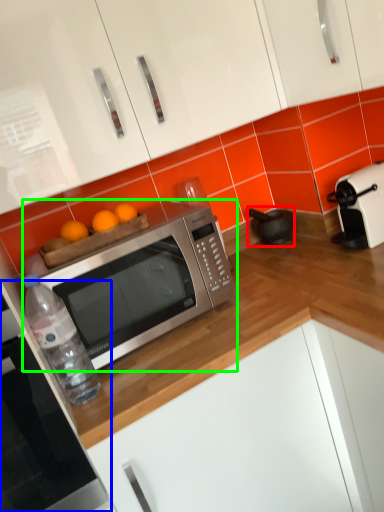
Question: Based on their relative distances, which object is farther from appliance (highlighted by a red box)? Choose from oven (highlighted by a blue box) and microwave oven (highlighted by a green box).

Choices:
 (A) oven
 (B) microwave oven

Answer: (A)